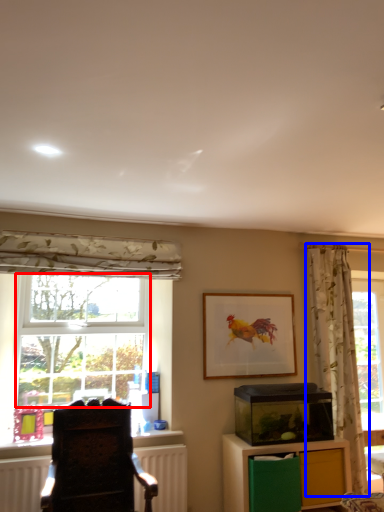
Question: Among these objects, which one is farthest to the camera, bay window (highlighted by a red box) or curtain (highlighted by a blue box)?

Choices:
 (A) bay window
 (B) curtain

Answer: (A)